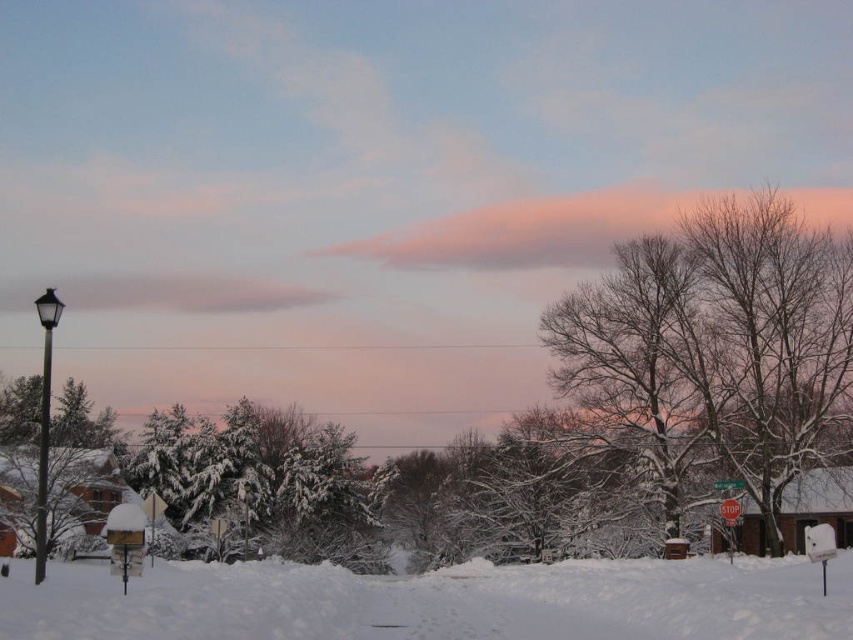
Looking at this image, is bare branches at upper right closer to camera compared to white fluffy snow at lower center?

No, bare branches at upper right is behind white fluffy snow at lower center.

Who is higher up, bare branches at upper right or white fluffy snow at lower center?

bare branches at upper right is higher up.

Is point (781, 332) positioned after point (787, 620)?

Yes, it is behind point (787, 620).

Image resolution: width=853 pixels, height=640 pixels. I want to click on bare branches at upper right, so click(x=717, y=346).

Is bare branches at upper right to the left of black metal lamp post at left from the viewer's perspective?

No, bare branches at upper right is not to the left of black metal lamp post at left.

Who is more forward, (712,451) or (48,394)?

Positioned in front is point (48,394).

What are the coordinates of `bare branches at upper right` in the screenshot? It's located at (717, 346).

Which is above, white fluffy snow at lower center or black metal lamp post at left?

white fluffy snow at lower center is higher up.

Is white fluffy snow at lower center above black metal lamp post at left?

Yes, white fluffy snow at lower center is above black metal lamp post at left.

The height and width of the screenshot is (640, 853). What do you see at coordinates (436, 602) in the screenshot?
I see `white fluffy snow at lower center` at bounding box center [436, 602].

This screenshot has width=853, height=640. In order to click on white fluffy snow at lower center in this screenshot , I will do `click(436, 602)`.